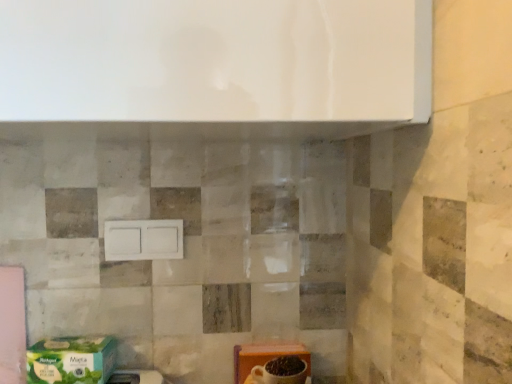
Question: Is green matte cardboard box at lower left, placed as the 2th cardboard box when sorted from right to left, to the left or to the right of white matte switch at center in the image?

Choices:
 (A) left
 (B) right

Answer: (A)

Question: Does point (95, 337) appear closer or farther from the camera than point (111, 226)?

Choices:
 (A) farther
 (B) closer

Answer: (B)

Question: Considering the real-world distances, which object is farthest from the white matte switch at center?

Choices:
 (A) orange cardboard box at lower right, which appears as the first cardboard box when viewed from the right
 (B) green matte cardboard box at lower left, which appears as the first cardboard box when viewed from the left

Answer: (A)

Question: Based on their relative distances, which object is nearer to the white matte switch at center?

Choices:
 (A) green matte cardboard box at lower left, placed as the 2th cardboard box when sorted from right to left
 (B) orange cardboard box at lower right, which appears as the first cardboard box when viewed from the right

Answer: (A)